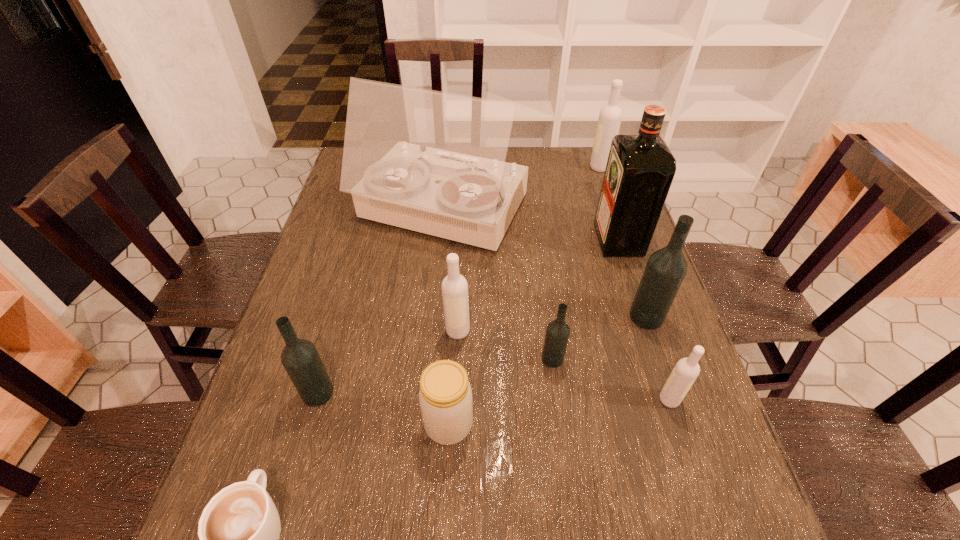
In order to click on the second closest black vodka to the leftmost white vodka in this screenshot , I will do `click(300, 358)`.

Identify the location of free space that satisfies the following two spatial constraints: 1. on the front side of the leftmost vodka; 2. on the right side of the smallest white vodka. (316, 400).